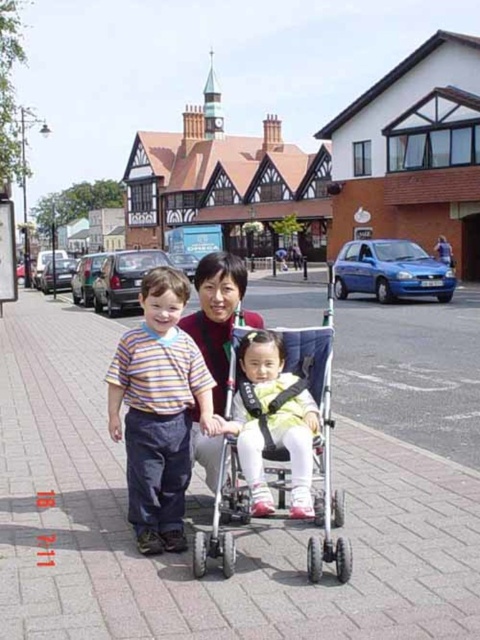
Is light blue fabric stroller at center thinner than light yellow fabric dress at center?

In fact, light blue fabric stroller at center might be wider than light yellow fabric dress at center.

Can you confirm if light blue fabric stroller at center is positioned to the left of light yellow fabric dress at center?

Incorrect, light blue fabric stroller at center is not on the left side of light yellow fabric dress at center.

Which is in front, point (331, 337) or point (286, 388)?

Point (286, 388) is in front.

The image size is (480, 640). I want to click on light blue fabric stroller at center, so click(x=320, y=438).

The width and height of the screenshot is (480, 640). What do you see at coordinates (158, 410) in the screenshot? I see `striped cotton shirt at left` at bounding box center [158, 410].

Can you confirm if striped cotton shirt at left is wider than light yellow fabric dress at center?

Correct, the width of striped cotton shirt at left exceeds that of light yellow fabric dress at center.

Who is more distant from viewer, [193,365] or [271,392]?

Positioned behind is point [193,365].

What are the coordinates of `striped cotton shirt at left` in the screenshot? It's located at (158, 410).

Between brick pavement at center and light yellow fabric dress at center, which one is positioned higher?

light yellow fabric dress at center is above.

Does point (403, 467) come behind point (288, 444)?

Yes, point (403, 467) is farther from viewer.

Is point (32, 637) closer to viewer compared to point (285, 426)?

Yes, point (32, 637) is in front of point (285, 426).

Identify the location of brick pavement at center. The image size is (480, 640). (238, 540).